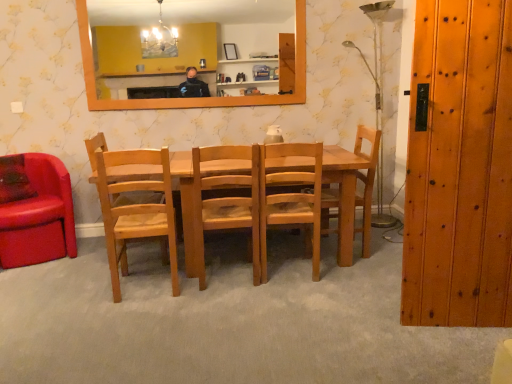
Find the location of a particular element. free location in front of light brown wood chair at center, which appears as the second chair when viewed from the right is located at coordinates (295, 294).